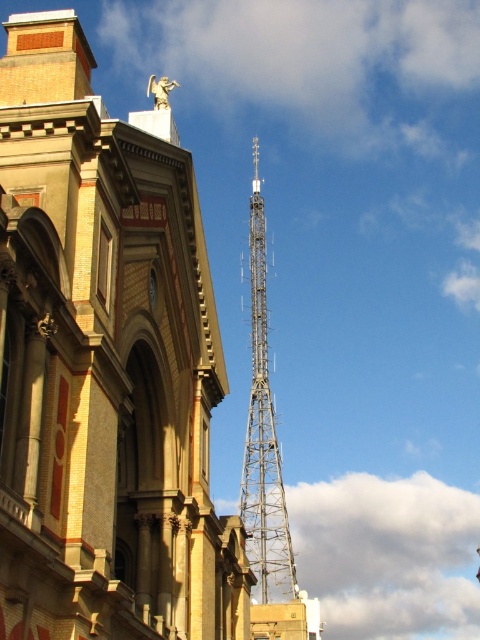
You are standing in front of the historic building and the modern communication tower. You notice two points marked in the scene. Which of the two points, point (x=203, y=298) or point (x=264, y=257), is closer to you?

Point (x=203, y=298) is closer to you than point (x=264, y=257).

You are standing in front of the historic building and want to walk to the metallic lattice tower at center. Which direction should you walk relative to the metallic lattice tower at right?

You should walk to the right of the metallic lattice tower at right because the metallic lattice tower at center is located to the right of the metallic lattice tower at right.